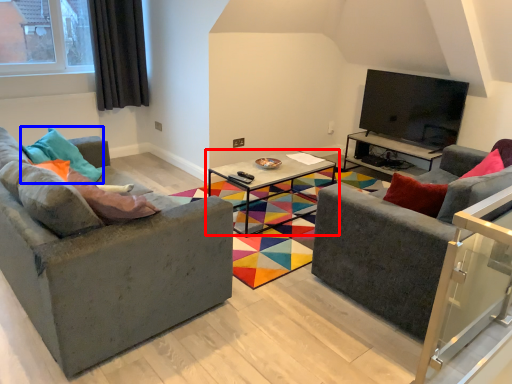
Question: Which object is further to the camera taking this photo, coffee table (highlighted by a red box) or pillow (highlighted by a blue box)?

Choices:
 (A) coffee table
 (B) pillow

Answer: (A)